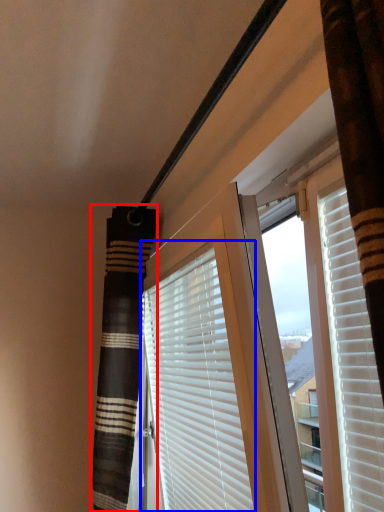
Question: Which object is further to the camera taking this photo, shower curtain (highlighted by a red box) or window blind (highlighted by a blue box)?

Choices:
 (A) shower curtain
 (B) window blind

Answer: (A)